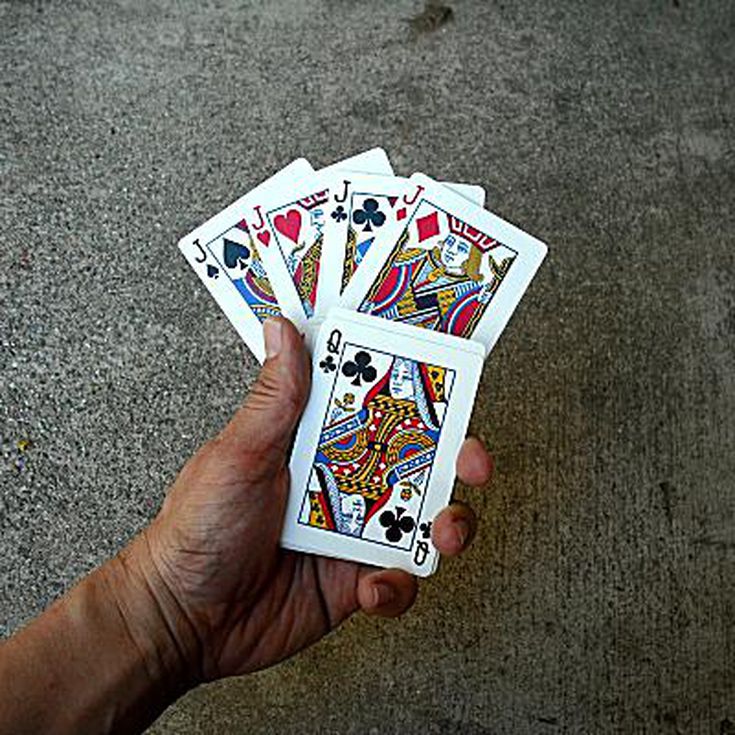
Where is `playing cards`? The image size is (735, 735). playing cards is located at coordinates (229, 262), (287, 226), (348, 218), (430, 250), (383, 456).